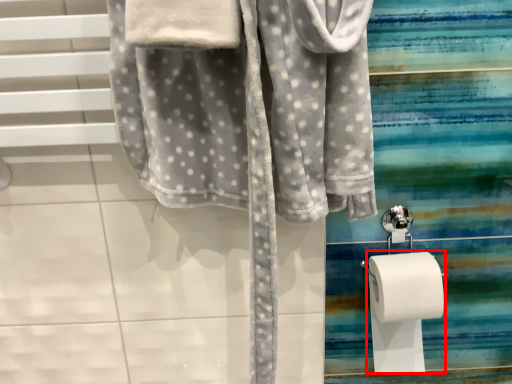
Question: Observing the image, what is the correct spatial positioning of toilet paper (annotated by the red box) in reference to towel?

Choices:
 (A) left
 (B) right

Answer: (B)